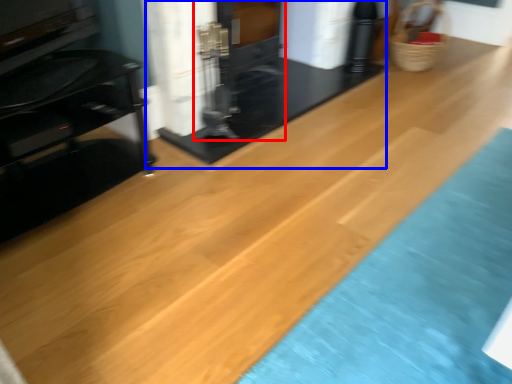
Question: Which of the following is the closest to the observer, fireplace (highlighted by a red box) or fireplace (highlighted by a blue box)?

Choices:
 (A) fireplace
 (B) fireplace

Answer: (B)